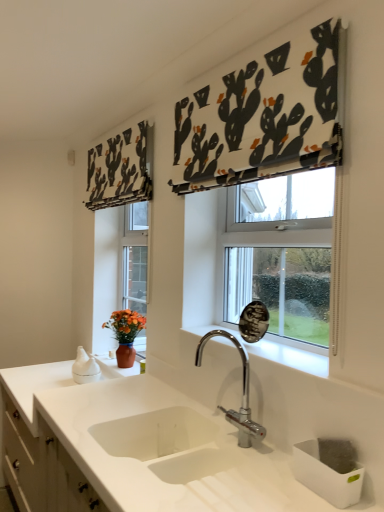
Question: Can you confirm if white glossy cabinet at lower left is wider than white fabric with cactus print at upper center, marked as the 1th curtain in a front-to-back arrangement?

Choices:
 (A) yes
 (B) no

Answer: (A)

Question: Is the position of white glossy cabinet at lower left less distant than that of white fabric with cactus print at upper center, marked as the 1th curtain in a front-to-back arrangement?

Choices:
 (A) no
 (B) yes

Answer: (A)

Question: From the image's perspective, would you say white glossy cabinet at lower left is positioned over white fabric with cactus print at upper center, acting as the second curtain starting from the back?

Choices:
 (A) yes
 (B) no

Answer: (B)

Question: Can you confirm if white glossy cabinet at lower left is thinner than white fabric with cactus print at upper center, the 1th curtain from the right?

Choices:
 (A) no
 (B) yes

Answer: (A)

Question: Is white glossy cabinet at lower left facing towards white fabric with cactus print at upper center, marked as the 1th curtain in a front-to-back arrangement?

Choices:
 (A) no
 (B) yes

Answer: (A)

Question: Could white fabric with cactus print at upper center, marked as the 1th curtain in a front-to-back arrangement, be considered to be inside white glossy cabinet at lower left?

Choices:
 (A) yes
 (B) no

Answer: (B)

Question: Could white glossy sink at center be considered to be inside chrome metallic faucet at center?

Choices:
 (A) no
 (B) yes

Answer: (A)

Question: Is white glossy sink at center at the back of chrome metallic faucet at center?

Choices:
 (A) yes
 (B) no

Answer: (A)

Question: Considering the relative sizes of chrome metallic faucet at center and white glossy sink at center in the image provided, is chrome metallic faucet at center wider than white glossy sink at center?

Choices:
 (A) no
 (B) yes

Answer: (A)

Question: Is the position of chrome metallic faucet at center more distant than that of white glossy sink at center?

Choices:
 (A) yes
 (B) no

Answer: (A)

Question: From a real-world perspective, does chrome metallic faucet at center sit lower than white glossy sink at center?

Choices:
 (A) no
 (B) yes

Answer: (B)

Question: Is chrome metallic faucet at center thinner than white glossy sink at center?

Choices:
 (A) no
 (B) yes

Answer: (B)

Question: Is white fabric with cactus print at upper center, marked as the 1th curtain in a front-to-back arrangement, shorter than black fabric cactus-patterned curtain at upper left, which is the second curtain from right to left?

Choices:
 (A) no
 (B) yes

Answer: (A)